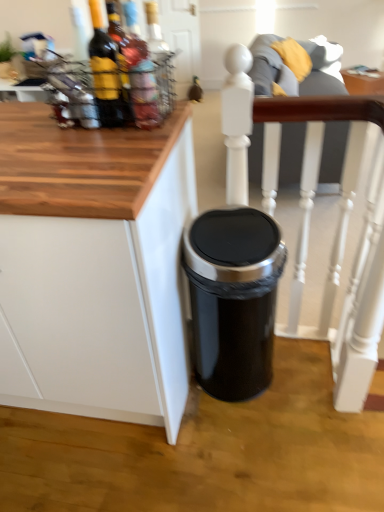
Locate an element on the screen. The height and width of the screenshot is (512, 384). unoccupied area in front of black metallic trash can at center is located at coordinates (245, 437).